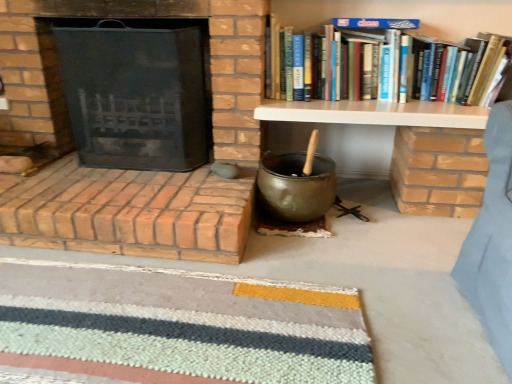
Locate an element on the screen. white wood shelf at upper right is located at coordinates pyautogui.click(x=375, y=113).

I want to click on black mesh fireplace screen at left, the second fireplace ordered from the bottom, so click(136, 92).

The image size is (512, 384). What do you see at coordinates (440, 65) in the screenshot?
I see `hardcover books at upper right` at bounding box center [440, 65].

Measure the distance between point (14, 337) and camera.

Point (14, 337) and camera are 1.16 meters apart from each other.

Measure the distance between striped wool doormat at lower center and camera.

striped wool doormat at lower center and camera are 3.37 feet apart from each other.

This screenshot has height=384, width=512. What do you see at coordinates (138, 174) in the screenshot?
I see `brick fireplace at left, the 1th fireplace in the bottom-to-top sequence` at bounding box center [138, 174].

This screenshot has width=512, height=384. I want to click on white wood shelf at upper right, so click(375, 113).

From a real-world perspective, which object stands above the other?

hardcover books at upper right, from a real-world perspective.

Does point (170, 182) lie in front of point (438, 54)?

That is True.

From the image's perspective, is brick fireplace at left, the 1th fireplace in the bottom-to-top sequence, positioned above or below hardcover books at upper right?

brick fireplace at left, the 1th fireplace in the bottom-to-top sequence, is situated lower than hardcover books at upper right in the image.

Which is nearer, (58, 267) or (356, 113)?

Point (58, 267)

You are a GUI agent. You are given a task and a screenshot of the screen. Output one action in this format:
    pyautogui.click(x=<x>, y=<y>)
    Task: Click on the doormat on the left of white wood shelf at upper right
    The width and height of the screenshot is (512, 384).
    Given the screenshot: What is the action you would take?
    pyautogui.click(x=175, y=327)

Is striped wool doormat at lower center oriented towards white wood shelf at upper right?

No, striped wool doormat at lower center is not aimed at white wood shelf at upper right.

Who is taller, striped wool doormat at lower center or white wood shelf at upper right?

white wood shelf at upper right is taller.

Considering the sizes of objects striped wool doormat at lower center and black mesh fireplace screen at left, the 1th fireplace in the top-to-bottom sequence, in the image provided, who is taller, striped wool doormat at lower center or black mesh fireplace screen at left, the 1th fireplace in the top-to-bottom sequence,?

black mesh fireplace screen at left, the 1th fireplace in the top-to-bottom sequence, is taller.

Is striped wool doormat at lower center with black mesh fireplace screen at left, the 1th fireplace in the top-to-bottom sequence?

No.

From a real-world perspective, is striped wool doormat at lower center positioned above or below black mesh fireplace screen at left, the 1th fireplace in the top-to-bottom sequence?

From a real-world perspective, striped wool doormat at lower center is physically below black mesh fireplace screen at left, the 1th fireplace in the top-to-bottom sequence.

Which object is more forward, striped wool doormat at lower center or black mesh fireplace screen at left, the second fireplace ordered from the bottom?

striped wool doormat at lower center.

Does white wood shelf at upper right lie in front of striped wool doormat at lower center?

No, it is not.

At what (x,y) coordinates should I click in order to perform the action: click on doormat in front of the white wood shelf at upper right. Please return your answer as a coordinate pair (x, y). The image size is (512, 384). Looking at the image, I should click on (175, 327).

Which of these two, white wood shelf at upper right or striped wool doormat at lower center, is thinner?

white wood shelf at upper right is thinner.

Is white wood shelf at upper right in contact with striped wool doormat at lower center?

They are not placed beside each other.

Is black mesh fireplace screen at left, the second fireplace ordered from the bottom, facing towards white wood shelf at upper right?

No, black mesh fireplace screen at left, the second fireplace ordered from the bottom, is not oriented towards white wood shelf at upper right.

Based on the photo, are black mesh fireplace screen at left, the 1th fireplace in the top-to-bottom sequence, and white wood shelf at upper right beside each other?

No.

Considering the sizes of black mesh fireplace screen at left, the 1th fireplace in the top-to-bottom sequence, and white wood shelf at upper right in the image, is black mesh fireplace screen at left, the 1th fireplace in the top-to-bottom sequence, taller or shorter than white wood shelf at upper right?

Considering their sizes, black mesh fireplace screen at left, the 1th fireplace in the top-to-bottom sequence, has more height than white wood shelf at upper right.

Locate an element on the screen. The width and height of the screenshot is (512, 384). the 1st fireplace in front of the white wood shelf at upper right, counting from the anchor's position is located at coordinates (136, 92).

Who is smaller, hardcover books at upper right or black mesh fireplace screen at left, the second fireplace ordered from the bottom?

With smaller size is hardcover books at upper right.

Could you tell me if hardcover books at upper right is turned towards black mesh fireplace screen at left, the 1th fireplace in the top-to-bottom sequence?

No, hardcover books at upper right is not aimed at black mesh fireplace screen at left, the 1th fireplace in the top-to-bottom sequence.

From their relative heights in the image, would you say hardcover books at upper right is taller or shorter than black mesh fireplace screen at left, the second fireplace ordered from the bottom?

Clearly, hardcover books at upper right is shorter compared to black mesh fireplace screen at left, the second fireplace ordered from the bottom.

Is hardcover books at upper right not within black mesh fireplace screen at left, the second fireplace ordered from the bottom?

Yes, hardcover books at upper right is not within black mesh fireplace screen at left, the second fireplace ordered from the bottom.

From a real-world perspective, which is physically above, brick fireplace at left, acting as the second fireplace starting from the top, or black mesh fireplace screen at left, the second fireplace ordered from the bottom?

black mesh fireplace screen at left, the second fireplace ordered from the bottom.

Which object is further away from the camera taking this photo, brick fireplace at left, the 1th fireplace in the bottom-to-top sequence, or black mesh fireplace screen at left, the 1th fireplace in the top-to-bottom sequence?

black mesh fireplace screen at left, the 1th fireplace in the top-to-bottom sequence.

Can you see brick fireplace at left, acting as the second fireplace starting from the top, touching black mesh fireplace screen at left, the second fireplace ordered from the bottom?

No, brick fireplace at left, acting as the second fireplace starting from the top, is not making contact with black mesh fireplace screen at left, the second fireplace ordered from the bottom.

From the image's perspective, which object appears higher, brick fireplace at left, acting as the second fireplace starting from the top, or black mesh fireplace screen at left, the second fireplace ordered from the bottom?

black mesh fireplace screen at left, the second fireplace ordered from the bottom.

From the image's perspective, starting from the hardcover books at upper right, which fireplace is the 2nd one below? Please provide its 2D coordinates.

[(138, 174)]

Identify the location of table on the right of striped wool doormat at lower center. (375, 113).

From the image, which object appears to be nearer to brick fireplace at left, acting as the second fireplace starting from the top, hardcover books at upper right or black mesh fireplace screen at left, the second fireplace ordered from the bottom?

black mesh fireplace screen at left, the second fireplace ordered from the bottom.

Considering their positions, is black mesh fireplace screen at left, the 1th fireplace in the top-to-bottom sequence, positioned closer to brick fireplace at left, the 1th fireplace in the bottom-to-top sequence, than white wood shelf at upper right?

Based on the image, black mesh fireplace screen at left, the 1th fireplace in the top-to-bottom sequence, appears to be nearer to brick fireplace at left, the 1th fireplace in the bottom-to-top sequence.

From the image, which object appears to be nearer to white wood shelf at upper right, striped wool doormat at lower center or black mesh fireplace screen at left, the 1th fireplace in the top-to-bottom sequence?

The object closer to white wood shelf at upper right is black mesh fireplace screen at left, the 1th fireplace in the top-to-bottom sequence.

Looking at the image, which one is located closer to white wood shelf at upper right, hardcover books at upper right or brick fireplace at left, the 1th fireplace in the bottom-to-top sequence?

A: hardcover books at upper right.

Considering their positions, is white wood shelf at upper right positioned closer to brick fireplace at left, acting as the second fireplace starting from the top, than striped wool doormat at lower center?

striped wool doormat at lower center.

In the scene shown: Estimate the real-world distances between objects in this image. Which object is further from hardcover books at upper right, black mesh fireplace screen at left, the 1th fireplace in the top-to-bottom sequence, or white wood shelf at upper right?

black mesh fireplace screen at left, the 1th fireplace in the top-to-bottom sequence, is positioned further to the anchor hardcover books at upper right.

From the image, which object appears to be nearer to striped wool doormat at lower center, brick fireplace at left, the 1th fireplace in the bottom-to-top sequence, or hardcover books at upper right?

brick fireplace at left, the 1th fireplace in the bottom-to-top sequence, lies closer to striped wool doormat at lower center than the other object.

Based on their spatial positions, is black mesh fireplace screen at left, the second fireplace ordered from the bottom, or brick fireplace at left, acting as the second fireplace starting from the top, closer to white wood shelf at upper right?

Among the two, black mesh fireplace screen at left, the second fireplace ordered from the bottom, is located nearer to white wood shelf at upper right.

The width and height of the screenshot is (512, 384). I want to click on table between striped wool doormat at lower center and hardcover books at upper right, so click(375, 113).

You are a GUI agent. You are given a task and a screenshot of the screen. Output one action in this format:
    pyautogui.click(x=<x>, y=<y>)
    Task: Click on the table between brick fireplace at left, acting as the second fireplace starting from the top, and hardcover books at upper right, in the horizontal direction
    The image size is (512, 384).
    Given the screenshot: What is the action you would take?
    pyautogui.click(x=375, y=113)

You are a GUI agent. You are given a task and a screenshot of the screen. Output one action in this format:
    pyautogui.click(x=<x>, y=<y>)
    Task: Click on the fireplace between black mesh fireplace screen at left, the second fireplace ordered from the bottom, and striped wool doormat at lower center vertically
    This screenshot has width=512, height=384.
    Given the screenshot: What is the action you would take?
    pyautogui.click(x=138, y=174)

The height and width of the screenshot is (384, 512). Identify the location of doormat between black mesh fireplace screen at left, the second fireplace ordered from the bottom, and hardcover books at upper right, in the horizontal direction. (175, 327).